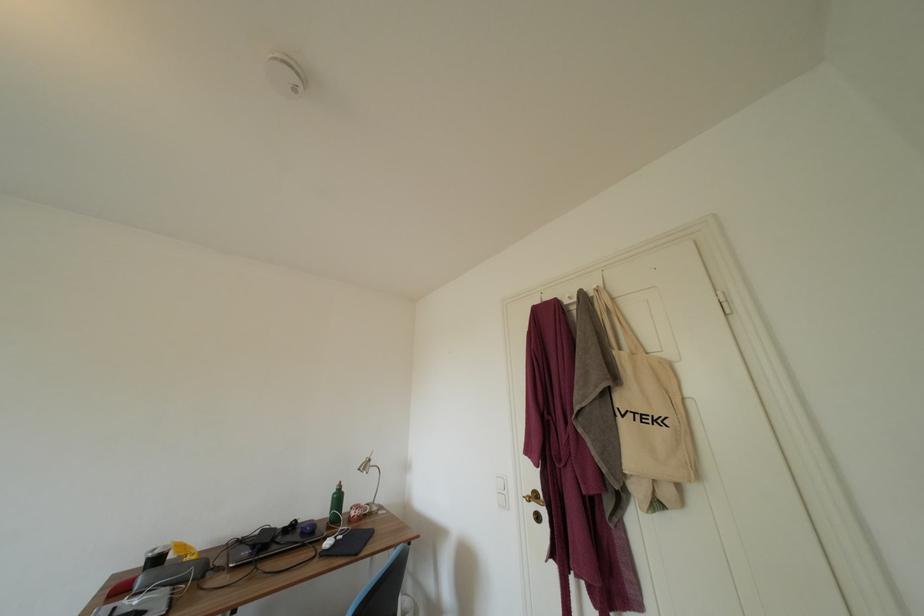
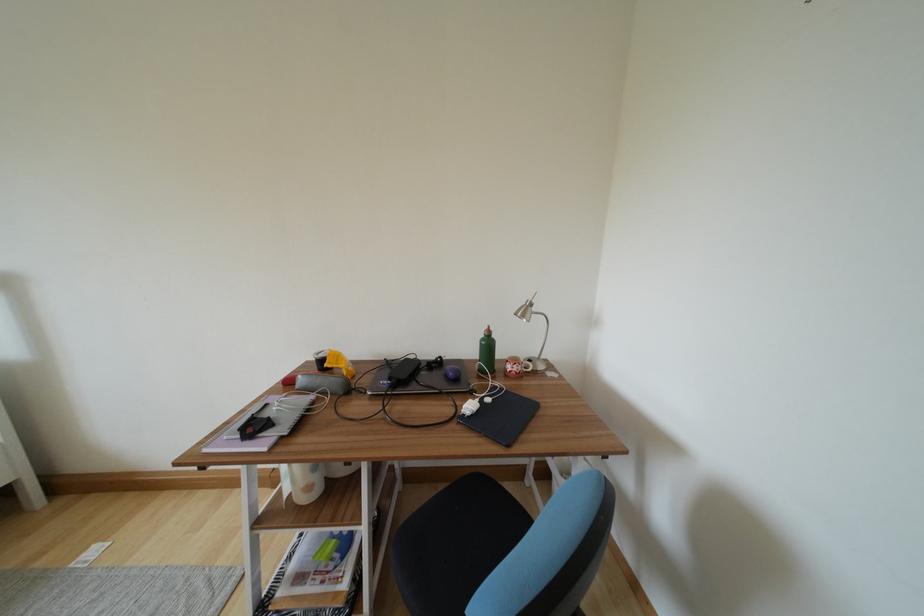
In the second image, find the point that corresponds to point 358,517 in the first image.

(514, 371)